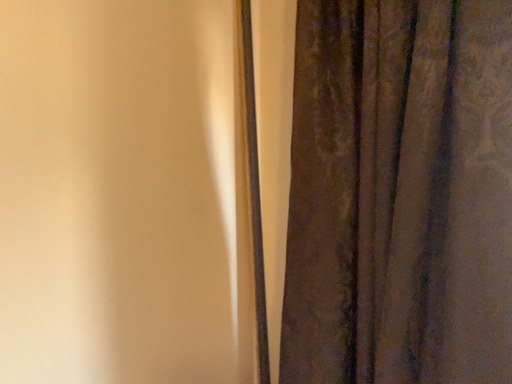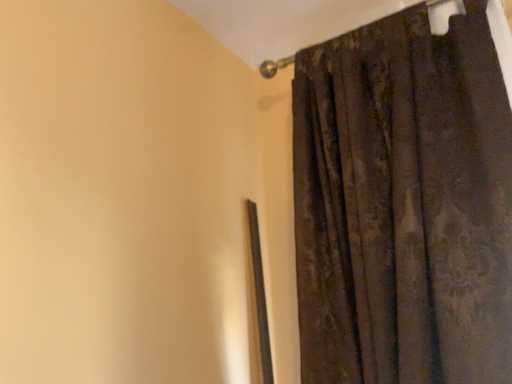
Question: How did the camera likely rotate when shooting the video?

Choices:
 (A) rotated upward
 (B) rotated downward

Answer: (A)